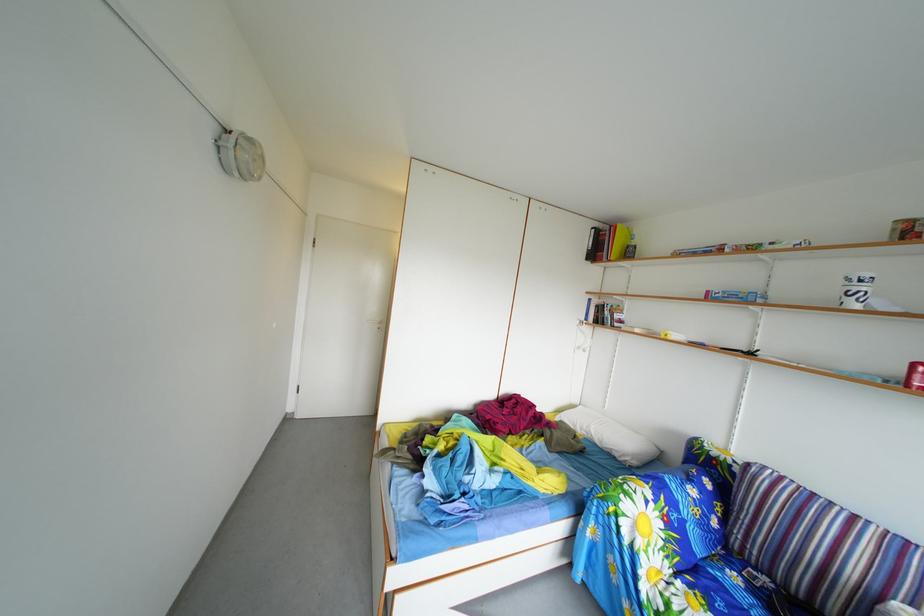
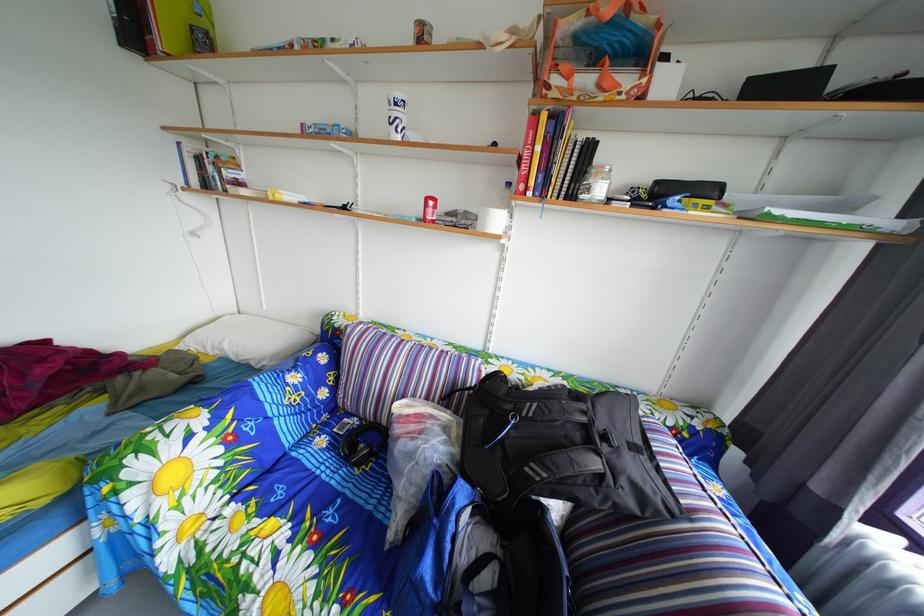
Where in the second image is the point corresponding to (x=776, y=588) from the first image?

(367, 428)